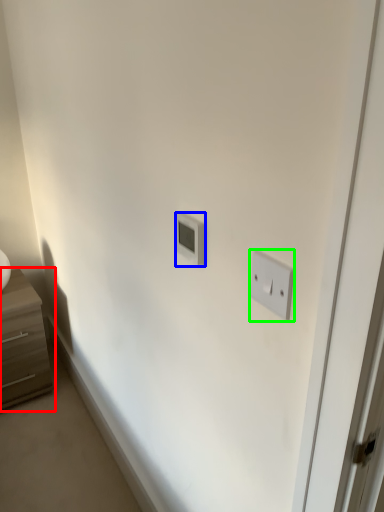
Question: Which object is positioned farthest from chest of drawers (highlighted by a red box)? Select from light switch (highlighted by a blue box) and light switch (highlighted by a green box).

Choices:
 (A) light switch
 (B) light switch

Answer: (B)